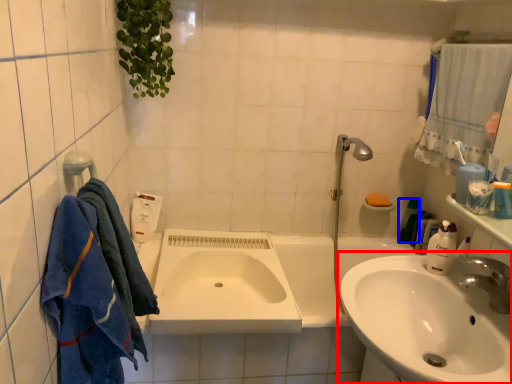
Question: Which object is closer to the camera taking this photo, sink (highlighted by a red box) or toiletry (highlighted by a blue box)?

Choices:
 (A) sink
 (B) toiletry

Answer: (A)